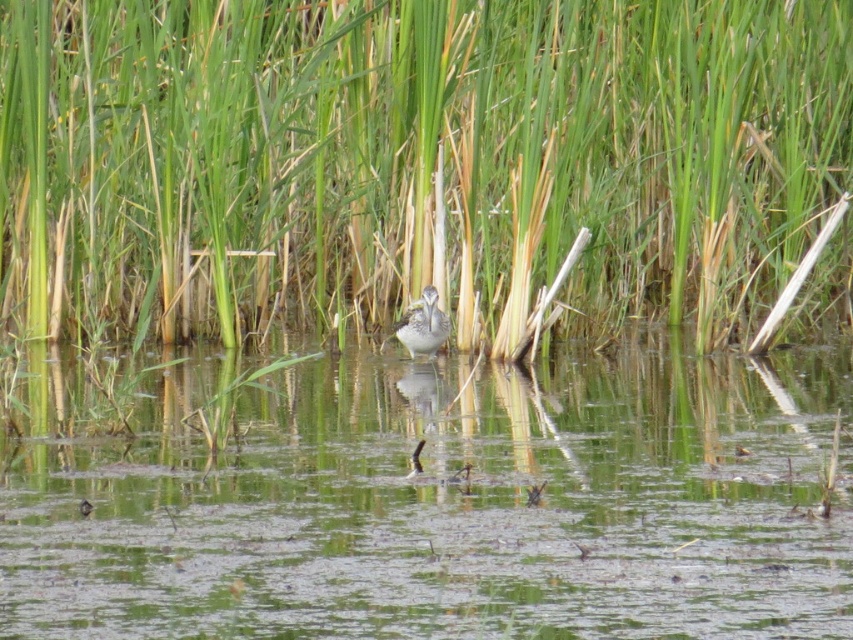
Question: Considering the real-world distances, which object is closest to the speckled gray bird at center?

Choices:
 (A) green grass at center
 (B) clear water at center

Answer: (A)

Question: Is green grass at center above speckled gray bird at center?

Choices:
 (A) yes
 (B) no

Answer: (A)

Question: Does green grass at center appear over clear water at center?

Choices:
 (A) yes
 (B) no

Answer: (A)

Question: Is clear water at center below speckled gray bird at center?

Choices:
 (A) no
 (B) yes

Answer: (B)

Question: Based on their relative distances, which object is nearer to the speckled gray bird at center?

Choices:
 (A) clear water at center
 (B) green grass at center

Answer: (B)

Question: Which of the following is the closest to the observer?

Choices:
 (A) (434, 324)
 (B) (67, 172)

Answer: (A)